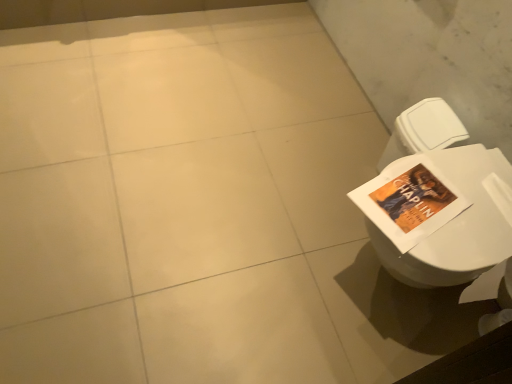
At what (x,y) coordinates should I click in order to perform the action: click on vacant point to the left of white glossy toilet at right. Please return your answer as a coordinate pair (x, y). This screenshot has width=512, height=384. Looking at the image, I should click on (275, 249).